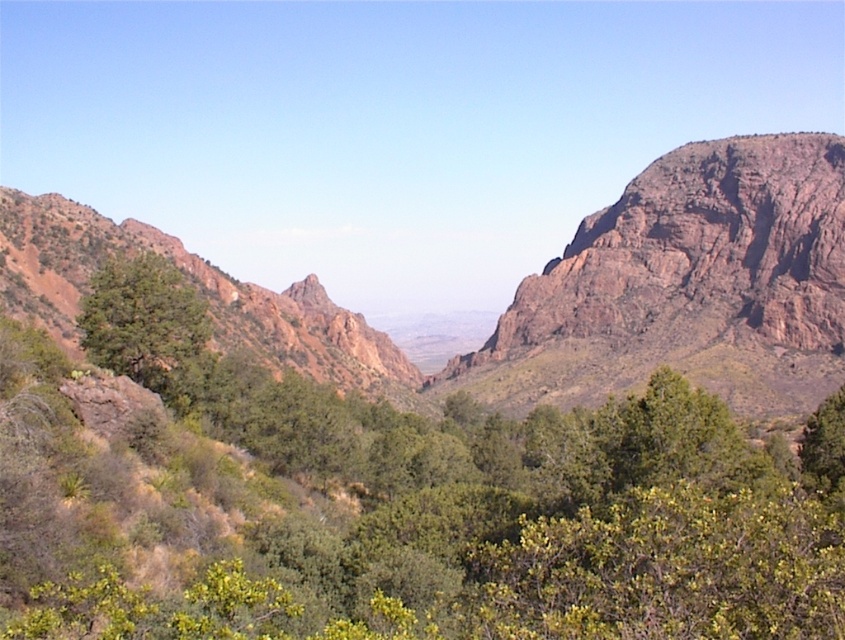
Based on the photo, you are a hiker planning to take a photo of the rustic rock mountain at center and the rustic rock formation at left. Based on their positions, which one should you focus on first to capture both in the frame?

The rustic rock formation at left should be focused on first since the rustic rock mountain at center is above it, allowing both to be included in the frame by adjusting the camera angle upwards.

You are a hiker planning to traverse from the rustic rock formation at left to the green leafy tree at center. Based on the distance provided, can you estimate how long it would take to walk this path if your average walking speed is 3 miles per hour?

The distance between the rustic rock formation at left and the green leafy tree at center is 408.92 feet. Converting this to miles, 408.92 feet is approximately 0.0775 miles. At an average walking speed of 3 mph, the time required would be roughly 0.0775 miles divided by 3 mph, which equals about 0.0258 hours. Converting hours to minutes by multiplying by 60 gives approximately 1.55 minutes. Therefore, it would take roughly 1.5 minutes to walk from the rustic rock formation at left to the green leafy tree.

You are a hiker planning to take a photo of the rusty rock mountain at right and the rustic rock formation at left. Which one should you position higher in your camera frame to capture both in the same shot?

You should position the rusty rock mountain at right higher in your camera frame because it is naturally located above the rustic rock formation at left in the scene.